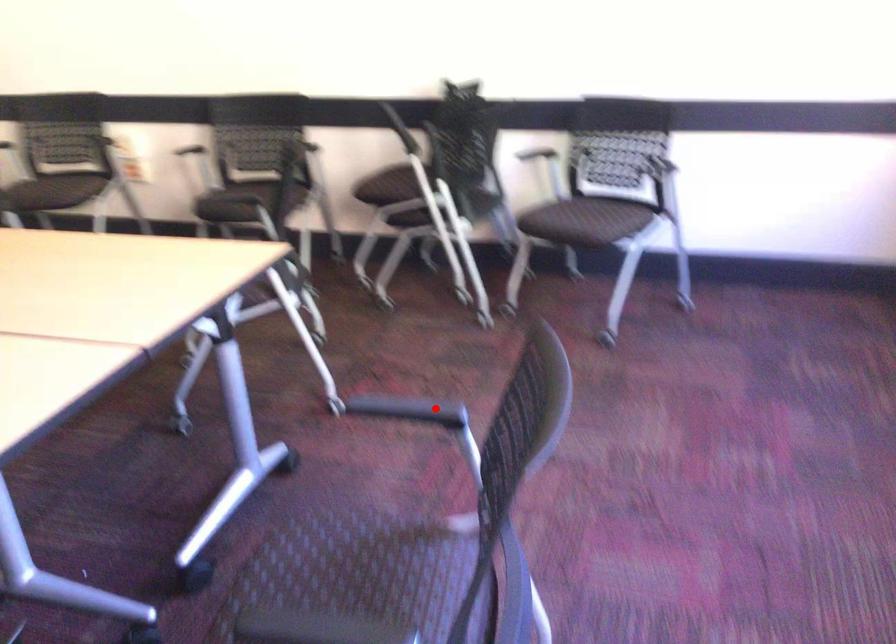
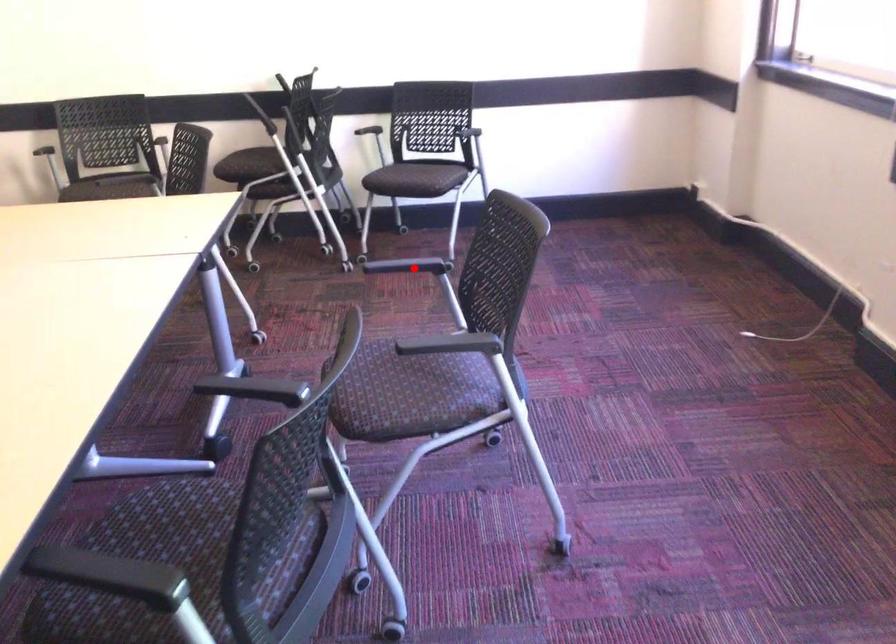
I am providing you with two images of the same scene from different viewpoints. A red point is marked on the first image and another point is marked on the second image. Is the red point in image1 aligned with the point shown in image2?

Yes